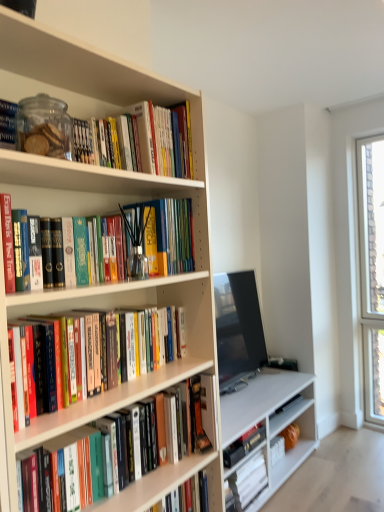
Question: In which direction should I rotate to look at hardcover book at lower center, which is the 5th book from top to bottom?

Choices:
 (A) right
 (B) left

Answer: (B)

Question: From the image's perspective, is white matte bookcase at left over hardcover book at lower center, which is counted as the seventh book, starting from the top?

Choices:
 (A) no
 (B) yes

Answer: (B)

Question: Is white matte bookcase at left surrounding hardcover book at lower center, the first book from the bottom?

Choices:
 (A) no
 (B) yes

Answer: (A)

Question: Is white matte bookcase at left with hardcover book at lower center, which is counted as the seventh book, starting from the top?

Choices:
 (A) no
 (B) yes

Answer: (A)

Question: Does white matte bookcase at left have a greater height compared to hardcover book at lower center, which is counted as the seventh book, starting from the top?

Choices:
 (A) yes
 (B) no

Answer: (A)

Question: From the image's perspective, does white matte bookcase at left appear lower than hardcover book at lower center, the first book from the bottom?

Choices:
 (A) yes
 (B) no

Answer: (B)

Question: Can you confirm if white matte bookcase at left is bigger than hardcover book at lower center, which is counted as the seventh book, starting from the top?

Choices:
 (A) yes
 (B) no

Answer: (A)

Question: From the image's perspective, does hardcover books at upper left, which is counted as the 2th book, starting from the top, appear lower than matte black tv at center?

Choices:
 (A) yes
 (B) no

Answer: (B)

Question: Does hardcover books at upper left, the sixth book when ordered from bottom to top, appear on the right side of matte black tv at center?

Choices:
 (A) yes
 (B) no

Answer: (B)

Question: Is hardcover books at upper left, the sixth book when ordered from bottom to top, positioned far away from matte black tv at center?

Choices:
 (A) yes
 (B) no

Answer: (A)

Question: From a real-world perspective, is hardcover books at upper left, the sixth book when ordered from bottom to top, on top of matte black tv at center?

Choices:
 (A) no
 (B) yes

Answer: (B)

Question: Does hardcover books at upper left, the sixth book when ordered from bottom to top, lie in front of matte black tv at center?

Choices:
 (A) yes
 (B) no

Answer: (A)

Question: Is hardcover books at upper left, the sixth book when ordered from bottom to top, behind matte black tv at center?

Choices:
 (A) yes
 (B) no

Answer: (B)

Question: Can you confirm if matte black tv at center is smaller than hardcover book at lower center, which is the 5th book from top to bottom?

Choices:
 (A) no
 (B) yes

Answer: (A)